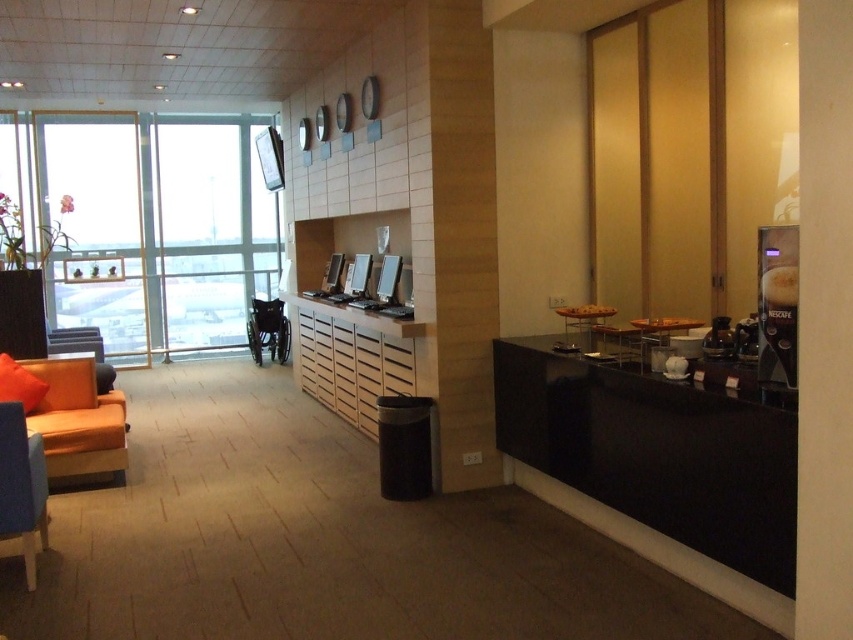
You are a person in a wheelchair trying to reach the orange fabric couch at left from your current position near the transparent glass window at left. Which direction should you move to get closer to the couch?

You should move away from the transparent glass window at left because the couch is behind the window, so moving backward would bring you closer to the orange fabric couch at left.